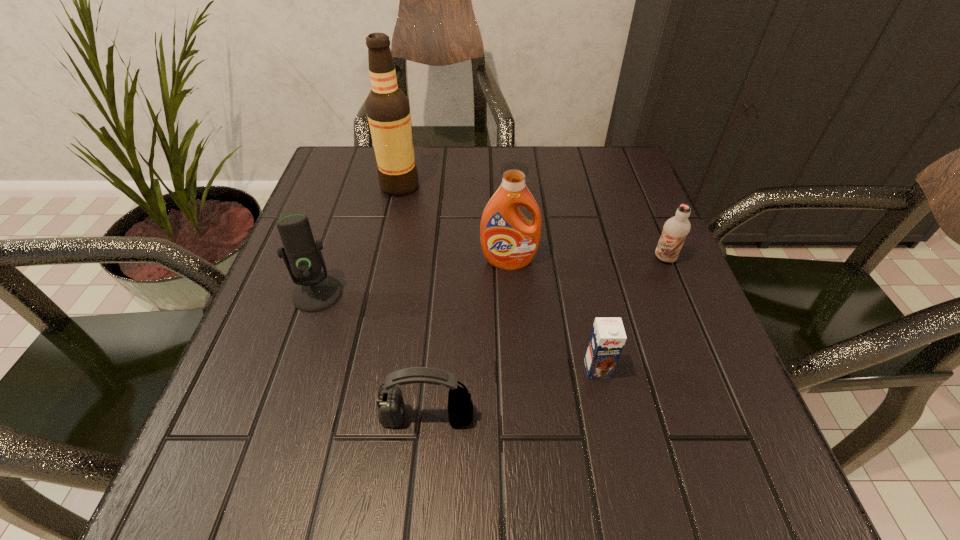
This screenshot has width=960, height=540. In order to click on vacant space in between the nearest object and the third object from right to left in this screenshot , I will do `click(468, 339)`.

The image size is (960, 540). I want to click on empty space that is in between the fourth shortest object and the nearest object, so click(x=372, y=355).

At what (x,y) coordinates should I click in order to perform the action: click on free area in between the nearest object and the detergent. Please return your answer as a coordinate pair (x, y). Looking at the image, I should click on (468, 339).

Identify the location of vacant area that lies between the leftmost object and the rightmost object. The width and height of the screenshot is (960, 540). (491, 276).

Image resolution: width=960 pixels, height=540 pixels. In order to click on unoccupied area between the farther chocolate milk and the third object from right to left in this screenshot , I will do `click(587, 260)`.

Locate an element on the screen. free spot between the third nearest object and the alcohol is located at coordinates (358, 240).

You are a GUI agent. You are given a task and a screenshot of the screen. Output one action in this format:
    pyautogui.click(x=<x>, y=<y>)
    Task: Click on the free area in between the second object from left to right and the leftmost object
    The width and height of the screenshot is (960, 540).
    Given the screenshot: What is the action you would take?
    pyautogui.click(x=358, y=240)

Where is `free point between the microphone and the farthest object`? Image resolution: width=960 pixels, height=540 pixels. free point between the microphone and the farthest object is located at coordinates (358, 240).

Point out which object is positioned as the fifth nearest to the detergent. Please provide its 2D coordinates. Your answer should be formatted as a tuple, i.e. [(x, y)], where the tuple contains the x and y coordinates of a point satisfying the conditions above.

[(390, 402)]

Where is `object that is the second closest to the detergent`? object that is the second closest to the detergent is located at coordinates (675, 229).